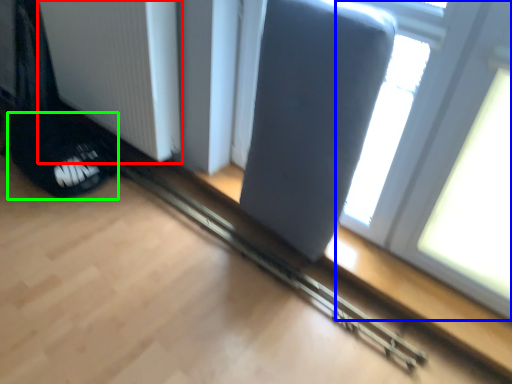
Question: Which object is the farthest from radiator (highlighted by a red box)? Choose among these: window (highlighted by a blue box) or footwear (highlighted by a green box).

Choices:
 (A) window
 (B) footwear

Answer: (A)